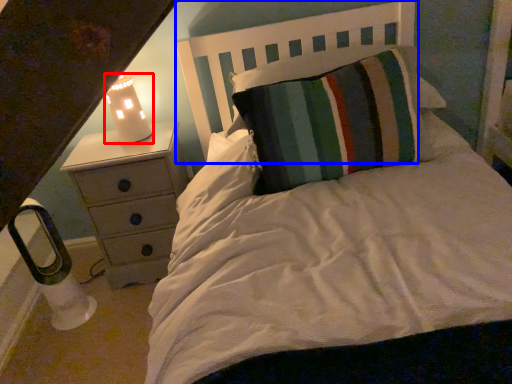
Question: Which object appears farthest to the camera in this image, lamp (highlighted by a red box) or headboard (highlighted by a blue box)?

Choices:
 (A) lamp
 (B) headboard

Answer: (A)